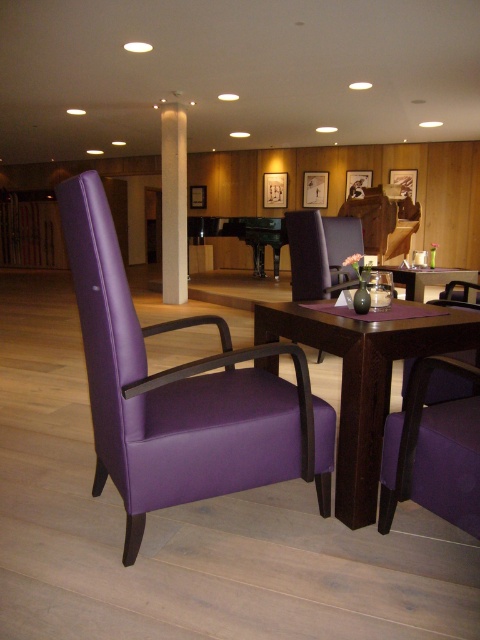
From the picture: Which is more to the right, dark wood table at center or purple fabric chair at center?

purple fabric chair at center is more to the right.

What do you see at coordinates (364, 380) in the screenshot? This screenshot has height=640, width=480. I see `dark wood table at center` at bounding box center [364, 380].

In order to click on dark wood table at center in this screenshot , I will do `click(364, 380)`.

Can you confirm if purple fabric swivel chair at lower right is positioned to the left of purple fabric table at center?

Correct, you'll find purple fabric swivel chair at lower right to the left of purple fabric table at center.

Is point (405, 404) less distant than point (433, 273)?

Yes, it is in front of point (433, 273).

The height and width of the screenshot is (640, 480). I want to click on purple fabric swivel chair at lower right, so click(433, 449).

Does purple leather armchair at left have a greater width compared to purple fabric table at center?

Incorrect, purple leather armchair at left's width does not surpass purple fabric table at center's.

Between point (170, 440) and point (420, 284), which one is positioned behind?

Positioned behind is point (420, 284).

What are the coordinates of `purple leather armchair at left` in the screenshot? It's located at (180, 392).